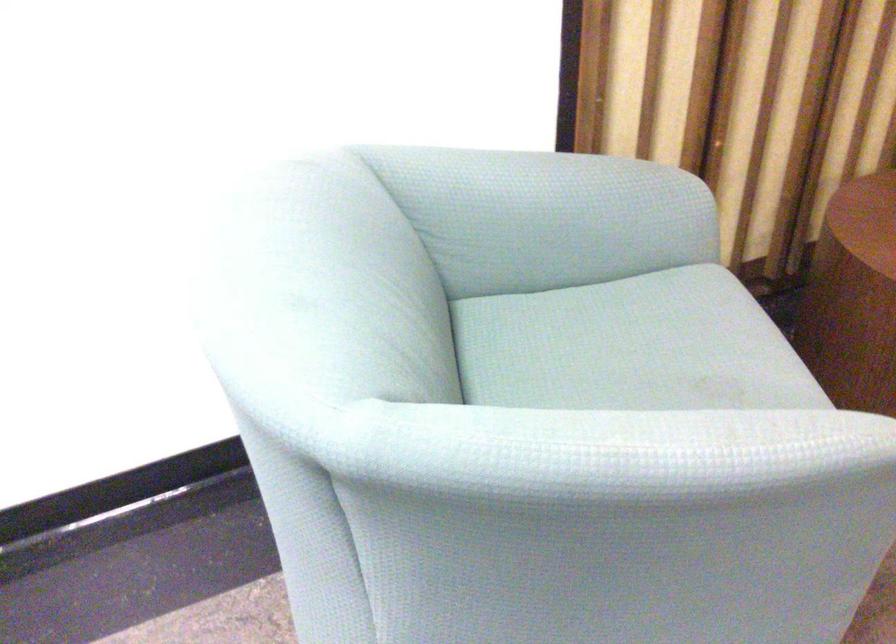
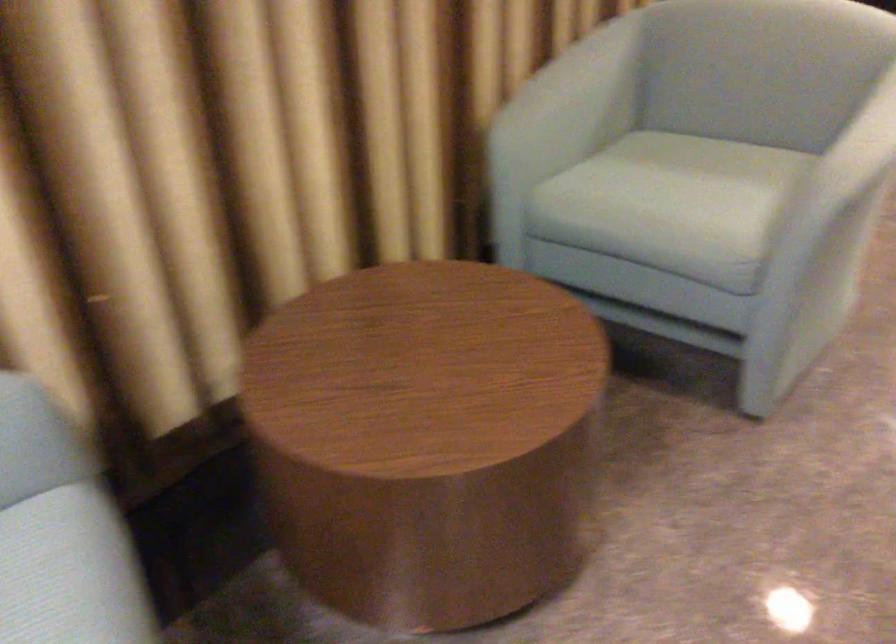
Question: How did the camera likely rotate?

Choices:
 (A) Left
 (B) Right
 (C) Up
 (D) Down

Answer: (B)